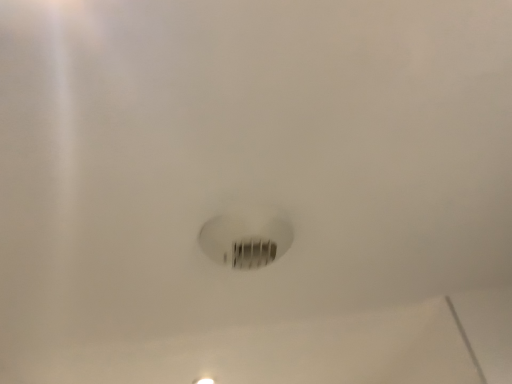
Measure the distance between white matte light bulb at center and camera.

29.37 inches.

The width and height of the screenshot is (512, 384). I want to click on white matte light bulb at center, so click(x=246, y=236).

The height and width of the screenshot is (384, 512). What do you see at coordinates (246, 236) in the screenshot? I see `white matte light bulb at center` at bounding box center [246, 236].

What is the approximate height of white matte light bulb at center?

The height of white matte light bulb at center is 2.19 inches.

Identify the location of white glossy light fixture at center. This screenshot has height=384, width=512. (204, 380).

This screenshot has height=384, width=512. What do you see at coordinates (204, 380) in the screenshot?
I see `white glossy light fixture at center` at bounding box center [204, 380].

Locate an element on the screen. This screenshot has height=384, width=512. white matte light bulb at center is located at coordinates (246, 236).

Visually, is white glossy light fixture at center positioned to the left or to the right of white matte light bulb at center?

white glossy light fixture at center is positioned on white matte light bulb at center's left side.

Which object is closer to the camera, white glossy light fixture at center or white matte light bulb at center?

white matte light bulb at center is closer to the camera.

Does point (198, 380) lie behind point (274, 225)?

Yes.

From the image's perspective, is white glossy light fixture at center on white matte light bulb at center?

No, from the image's perspective, white glossy light fixture at center is not above white matte light bulb at center.

From a real-world perspective, is white glossy light fixture at center positioned over white matte light bulb at center based on gravity?

Yes, from a real-world perspective, white glossy light fixture at center is over white matte light bulb at center

Considering the relative sizes of white glossy light fixture at center and white matte light bulb at center in the image provided, is white glossy light fixture at center wider than white matte light bulb at center?

Incorrect, the width of white glossy light fixture at center does not surpass that of white matte light bulb at center.

Considering the sizes of objects white glossy light fixture at center and white matte light bulb at center in the image provided, who is shorter, white glossy light fixture at center or white matte light bulb at center?

white glossy light fixture at center is shorter.

Who is smaller, white glossy light fixture at center or white matte light bulb at center?

With smaller size is white glossy light fixture at center.

From the picture: Is white glossy light fixture at center not inside white matte light bulb at center?

Yes, white glossy light fixture at center is located beyond the bounds of white matte light bulb at center.

Does white glossy light fixture at center touch white matte light bulb at center?

white glossy light fixture at center and white matte light bulb at center are clearly separated.

Is white glossy light fixture at center positioned with its back to white matte light bulb at center?

No, white glossy light fixture at center is not facing the opposite direction of white matte light bulb at center.

How many degrees apart are the facing directions of white glossy light fixture at center and white matte light bulb at center?

The angular difference between white glossy light fixture at center and white matte light bulb at center is 0.0289 degrees.

How distant is white glossy light fixture at center from white matte light bulb at center?

white glossy light fixture at center and white matte light bulb at center are 33.18 inches apart from each other.

The height and width of the screenshot is (384, 512). Find the location of `light fixture below the white matte light bulb at center (from the image's perspective)`. light fixture below the white matte light bulb at center (from the image's perspective) is located at coordinates (204, 380).

From the picture: Which is more to the left, white matte light bulb at center or white glossy light fixture at center?

From the viewer's perspective, white glossy light fixture at center appears more on the left side.

Is white matte light bulb at center closer to camera compared to white glossy light fixture at center?

Yes, it is.

Which is in front, point (230, 248) or point (199, 380)?

The point (230, 248) is closer to the camera.

From the image's perspective, is white matte light bulb at center beneath white glossy light fixture at center?

Actually, white matte light bulb at center appears above white glossy light fixture at center in the image.

From a real-world perspective, is white matte light bulb at center above or below white glossy light fixture at center?

In terms of real-world spatial position, white matte light bulb at center is below white glossy light fixture at center.

Which object is wider, white matte light bulb at center or white glossy light fixture at center?

With larger width is white matte light bulb at center.

Can you confirm if white matte light bulb at center is taller than white glossy light fixture at center?

Indeed, white matte light bulb at center has a greater height compared to white glossy light fixture at center.

Between white matte light bulb at center and white glossy light fixture at center, which one has larger size?

With larger size is white matte light bulb at center.

Is white matte light bulb at center inside the boundaries of white glossy light fixture at center, or outside?

The correct answer is: outside.

Would you say white matte light bulb at center is a long distance from white glossy light fixture at center?

No, there isn't a large distance between white matte light bulb at center and white glossy light fixture at center.

Could you tell me if white matte light bulb at center is turned towards white glossy light fixture at center?

No, white matte light bulb at center is not aimed at white glossy light fixture at center.

How different are the orientations of white matte light bulb at center and white glossy light fixture at center in degrees?

The facing directions of white matte light bulb at center and white glossy light fixture at center are 0.0289 degrees apart.

Where is `light fixture behind the white matte light bulb at center`? light fixture behind the white matte light bulb at center is located at coordinates (204, 380).

Identify the location of light fixture that is on the left side of white matte light bulb at center. Image resolution: width=512 pixels, height=384 pixels. (204, 380).

At what (x,y) coordinates should I click in order to perform the action: click on light bulb located on the right of white glossy light fixture at center. Please return your answer as a coordinate pair (x, y). Looking at the image, I should click on (246, 236).